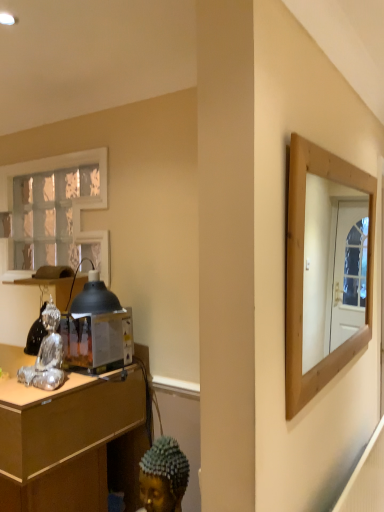
Question: Is white textured glass at upper left smaller than metallic/reflective toaster at left?

Choices:
 (A) yes
 (B) no

Answer: (B)

Question: Is white textured glass at upper left closer to the viewer compared to metallic/reflective toaster at left?

Choices:
 (A) no
 (B) yes

Answer: (A)

Question: Can you confirm if white textured glass at upper left is positioned to the left of metallic/reflective toaster at left?

Choices:
 (A) no
 (B) yes

Answer: (B)

Question: Can you confirm if white textured glass at upper left is wider than metallic/reflective toaster at left?

Choices:
 (A) yes
 (B) no

Answer: (B)

Question: Could you tell me if white textured glass at upper left is facing metallic/reflective toaster at left?

Choices:
 (A) no
 (B) yes

Answer: (A)

Question: From a real-world perspective, is wooden desk at left above or below silver metallic figurine at left?

Choices:
 (A) above
 (B) below

Answer: (B)

Question: Is wooden desk at left wider or thinner than silver metallic figurine at left?

Choices:
 (A) wide
 (B) thin

Answer: (A)

Question: In the image, is wooden desk at left on the left side or the right side of silver metallic figurine at left?

Choices:
 (A) left
 (B) right

Answer: (A)

Question: Considering the positions of point (61, 396) and point (61, 377), is point (61, 396) closer or farther from the camera than point (61, 377)?

Choices:
 (A) farther
 (B) closer

Answer: (B)

Question: Looking at their shapes, would you say wooden desk at left is wider or thinner than white textured glass at upper left?

Choices:
 (A) wide
 (B) thin

Answer: (A)

Question: Is wooden desk at left taller or shorter than white textured glass at upper left?

Choices:
 (A) short
 (B) tall

Answer: (A)

Question: Would you say wooden desk at left is inside or outside white textured glass at upper left?

Choices:
 (A) inside
 (B) outside

Answer: (B)

Question: Considering their positions, is wooden desk at left located in front of or behind white textured glass at upper left?

Choices:
 (A) front
 (B) behind

Answer: (A)

Question: From a real-world perspective, is white textured glass at upper left above or below silver metallic figurine at left?

Choices:
 (A) above
 (B) below

Answer: (A)

Question: From their relative heights in the image, would you say white textured glass at upper left is taller or shorter than silver metallic figurine at left?

Choices:
 (A) tall
 (B) short

Answer: (A)